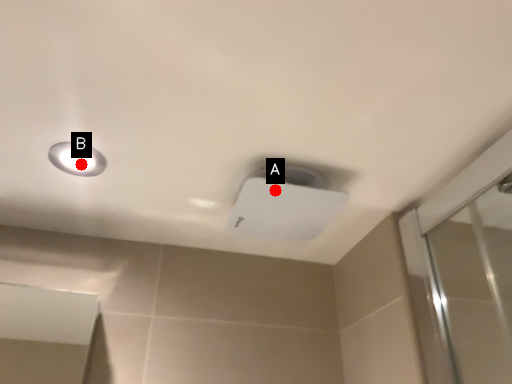
Question: Two points are circled on the image, labeled by A and B beside each circle. Among these points, which one is nearest to the camera?

Choices:
 (A) A is closer
 (B) B is closer

Answer: (A)